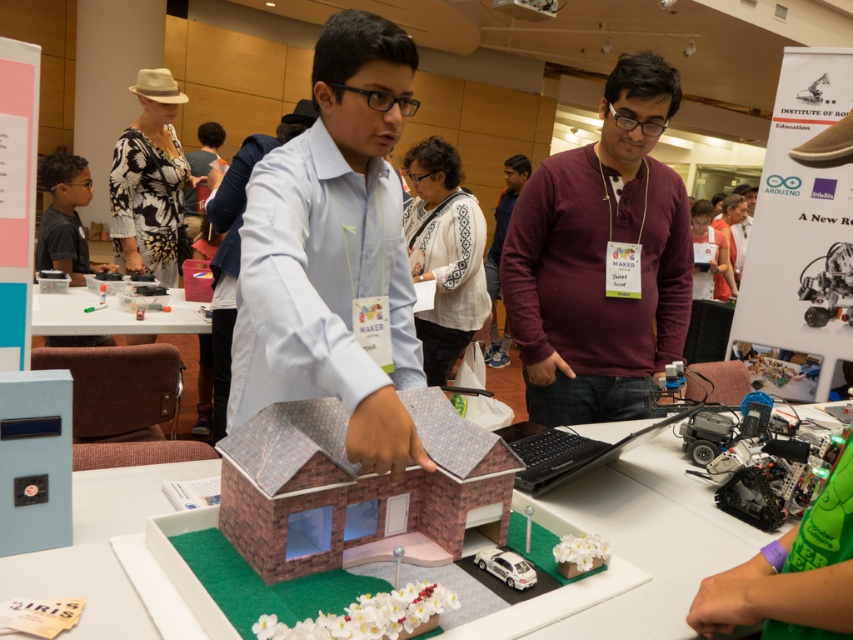
Between maroon sweater at center and white embroidered shirt at center, which one has less height?

maroon sweater at center

Between maroon sweater at center and white embroidered shirt at center, which one has more height?

white embroidered shirt at center is taller.

The height and width of the screenshot is (640, 853). I want to click on maroon sweater at center, so click(x=601, y=259).

Can you confirm if light blue shirt at center is positioned to the right of maroon sweater at center?

Incorrect, light blue shirt at center is not on the right side of maroon sweater at center.

Is light blue shirt at center thinner than maroon sweater at center?

Indeed, light blue shirt at center has a lesser width compared to maroon sweater at center.

Does point (410, 372) come farther from viewer compared to point (601, 282)?

No, it is not.

This screenshot has width=853, height=640. Identify the location of light blue shirt at center. (334, 253).

Is point (334, 35) behind point (415, 276)?

No, it is not.

Locate an element on the screen. light blue shirt at center is located at coordinates (334, 253).